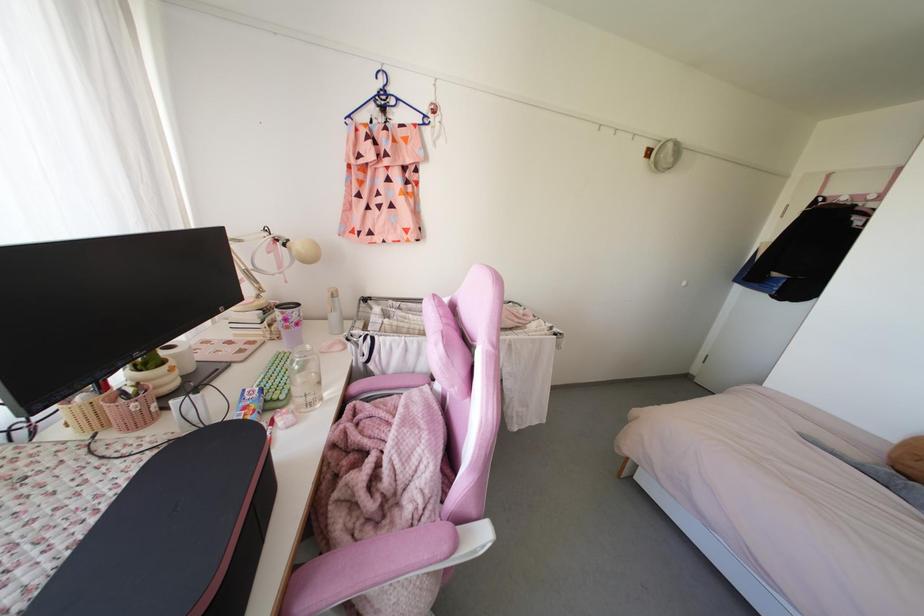
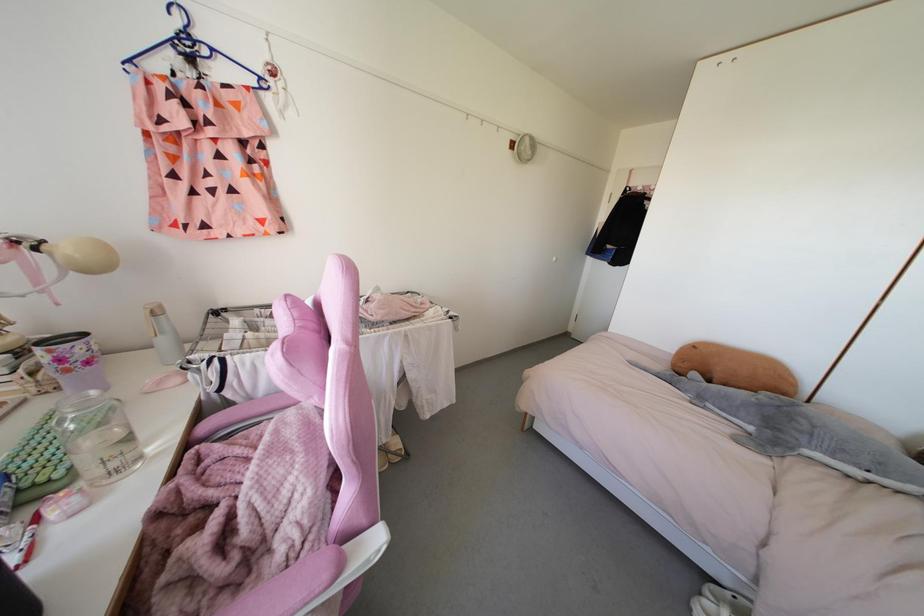
Where in the second image is the point corresponding to [388,493] from the first image?

(252, 543)